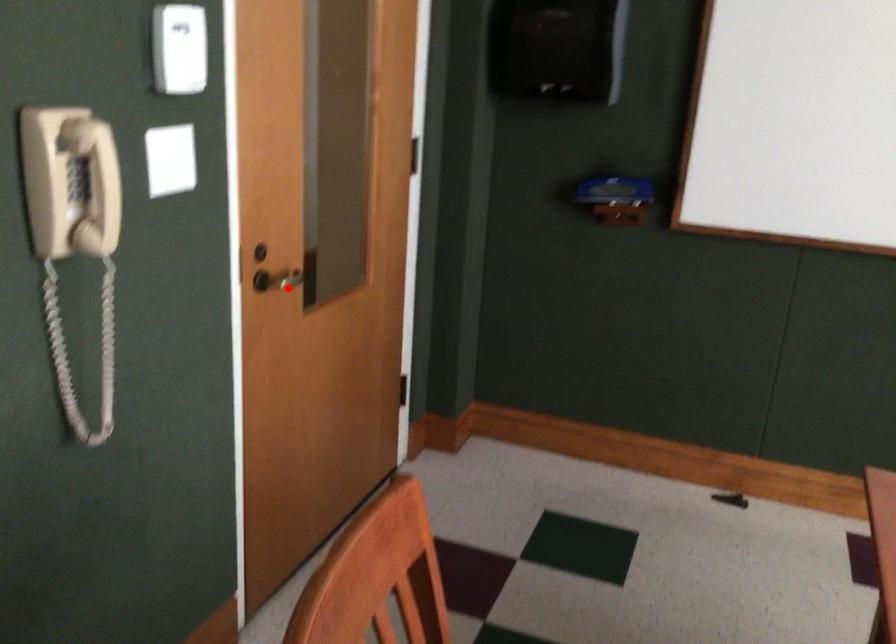
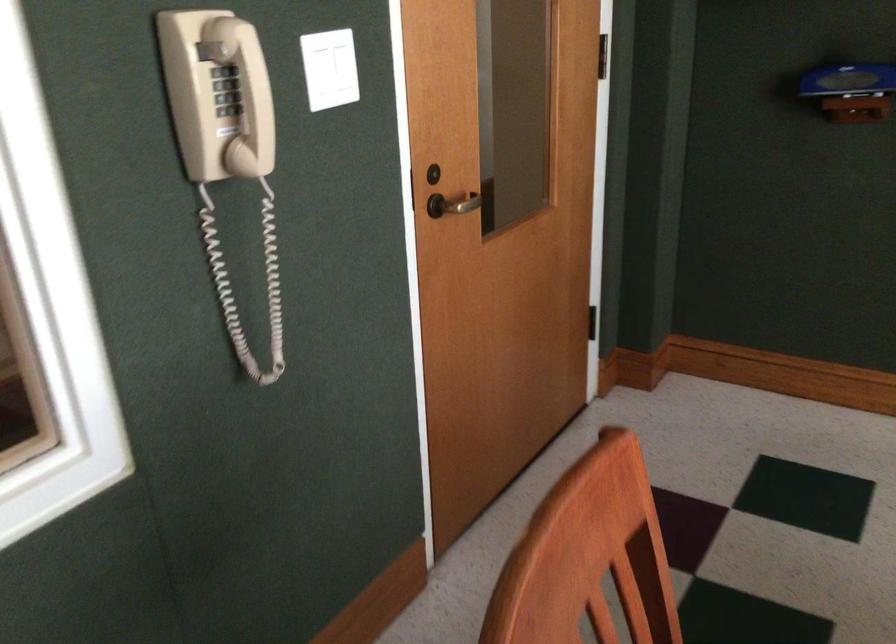
Where in the second image is the point corresponding to the highlighted location from the first image?

(458, 204)